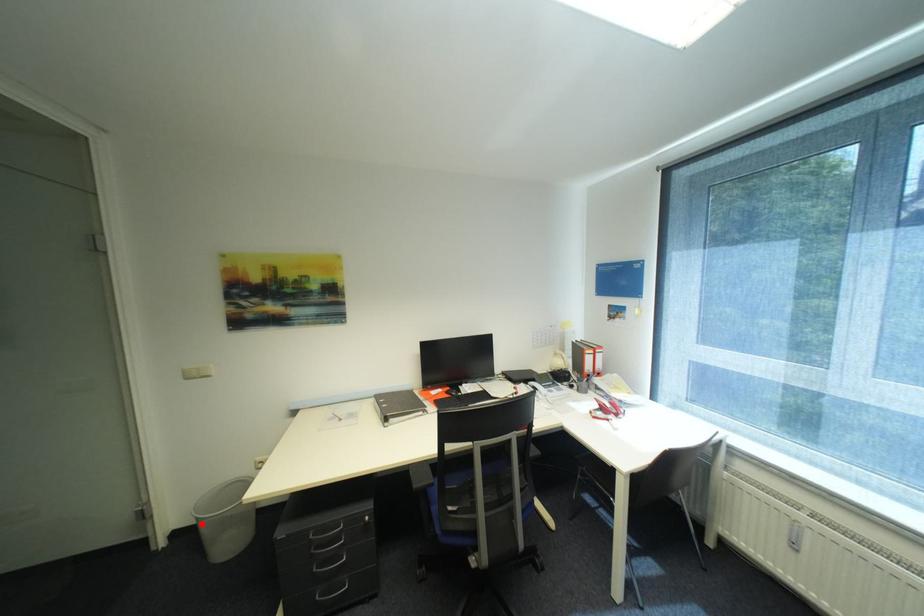
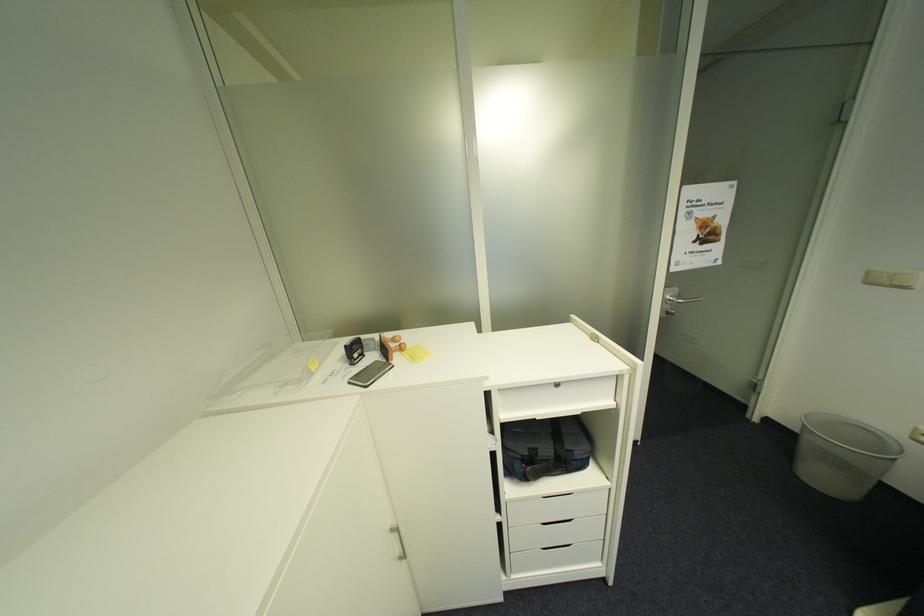
Where in the second image is the point corresponding to the highlighted location from the first image?

(805, 429)